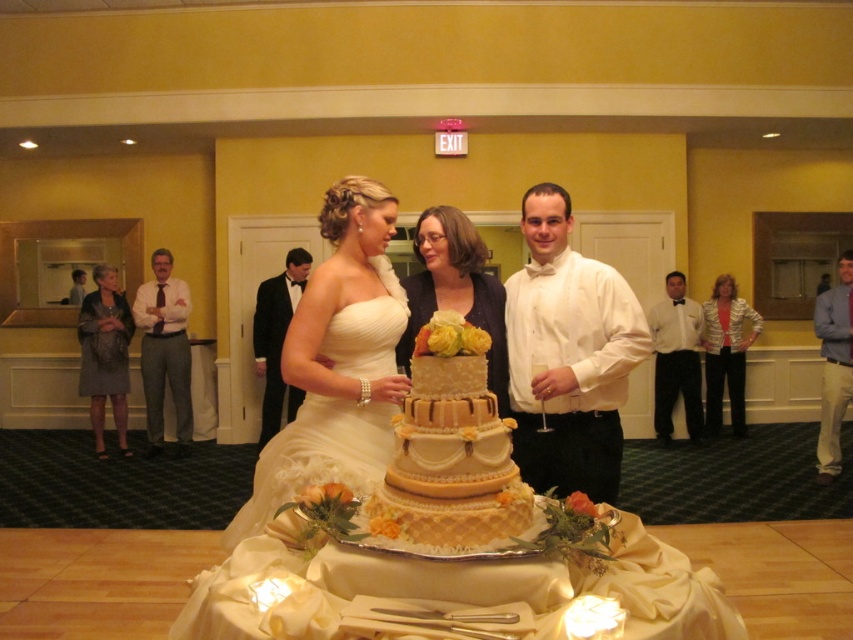
Question: Can you confirm if striped fabric jacket at center is positioned to the right of black satin suit at center?

Choices:
 (A) yes
 (B) no

Answer: (A)

Question: Which point appears closest to the camera in this image?

Choices:
 (A) (148, 321)
 (B) (733, 333)

Answer: (A)

Question: Which point is farther from the camera taking this photo?

Choices:
 (A) (160, 276)
 (B) (508, 365)
 (C) (294, 264)
 (D) (840, 321)

Answer: (A)

Question: From the image, what is the correct spatial relationship of white satin shirt at center in relation to shiny gold jacket at center?

Choices:
 (A) below
 (B) above

Answer: (B)

Question: Considering the relative positions of beige fondant cake at center and white satin wedding dress at center in the image provided, where is beige fondant cake at center located with respect to white satin wedding dress at center?

Choices:
 (A) left
 (B) right

Answer: (B)

Question: Which point is closer to the camera taking this photo?

Choices:
 (A) (741, 433)
 (B) (706, 308)
 (C) (555, 260)
 (D) (268, 288)

Answer: (C)